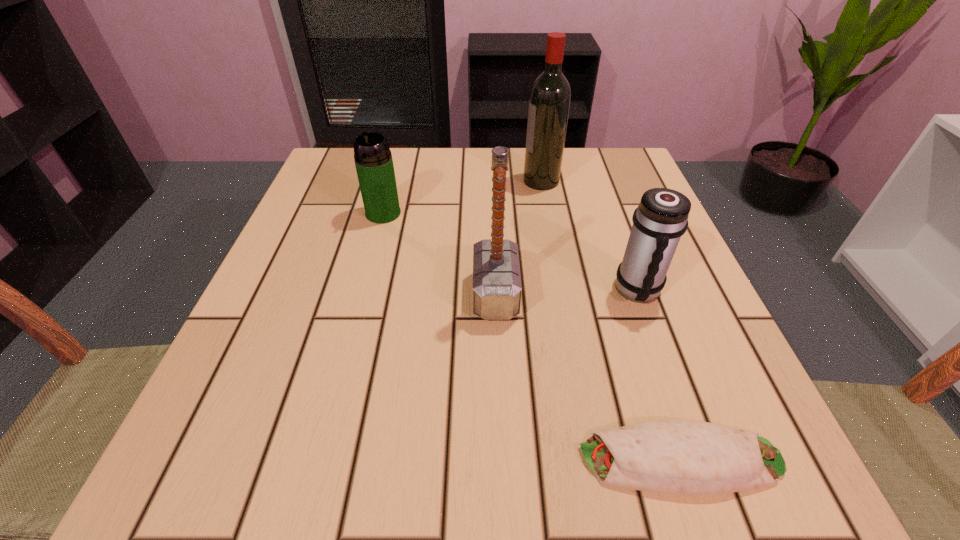
Identify the location of free point between the second object from left to right and the wine bottle. The width and height of the screenshot is (960, 540). (518, 238).

Find the location of a particular element. This screenshot has height=540, width=960. vacant region between the hammer and the farther thermos bottle is located at coordinates (440, 254).

Choose which object is the third nearest neighbor to the farthest object. Please provide its 2D coordinates. Your answer should be formatted as a tuple, i.e. [(x, y)], where the tuple contains the x and y coordinates of a point satisfying the conditions above.

[(373, 159)]

Identify which object is located as the nearest to the fourth object from right to left. Please provide its 2D coordinates. Your answer should be formatted as a tuple, i.e. [(x, y)], where the tuple contains the x and y coordinates of a point satisfying the conditions above.

[(661, 218)]

I want to click on vacant region that satisfies the following two spatial constraints: 1. on the label of the wine bottle; 2. from the spout of the leftmost object, so click(547, 213).

You are a GUI agent. You are given a task and a screenshot of the screen. Output one action in this format:
    pyautogui.click(x=<x>, y=<y>)
    Task: Click on the vacant space that satisfies the following two spatial constraints: 1. on the side with the handle of the right thermos bottle; 2. on the striking surface of the hammer
    Image resolution: width=960 pixels, height=540 pixels.
    Given the screenshot: What is the action you would take?
    pyautogui.click(x=640, y=294)